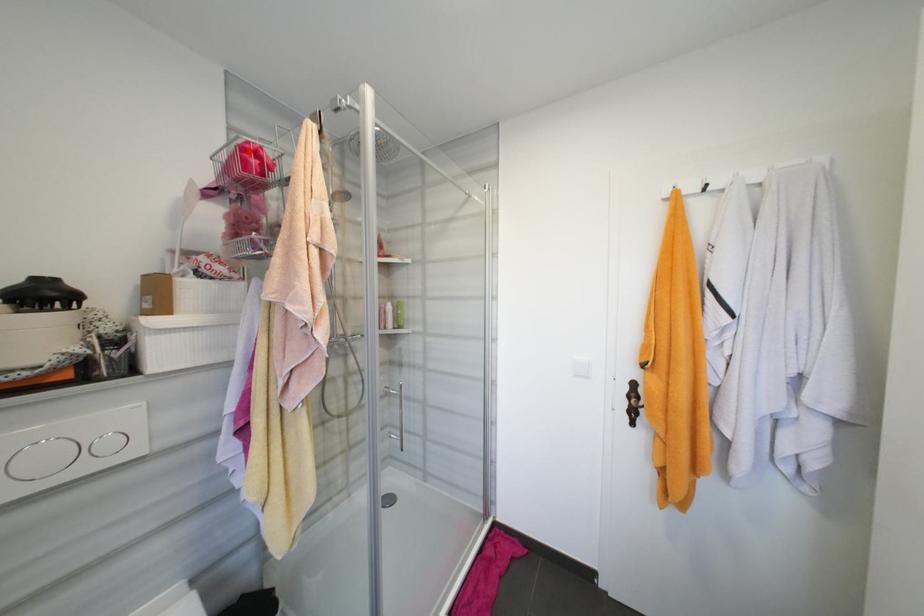
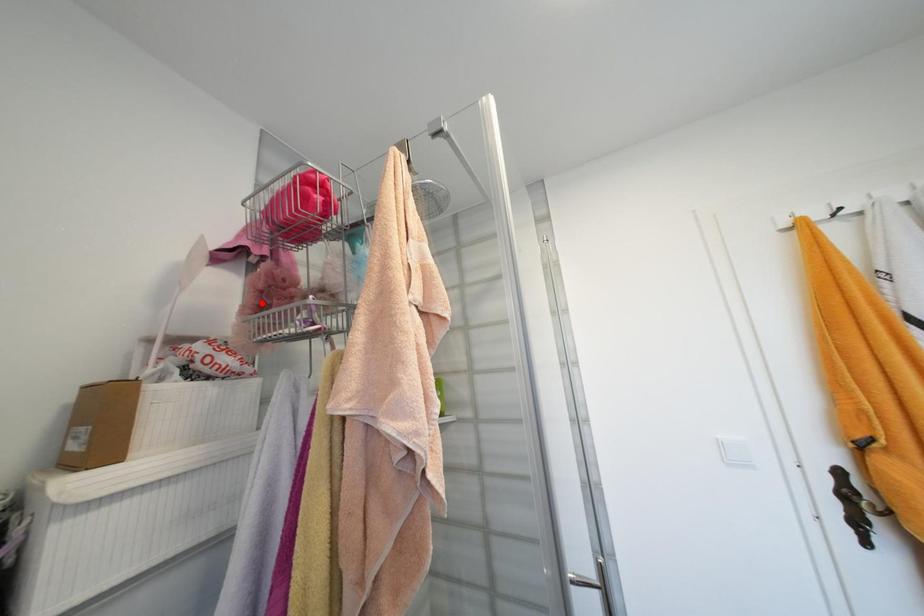
I am providing you with two images of the same scene from different viewpoints. A red point is marked on the first image and another point is marked on the second image. Is the marked point in image1 the same physical position as the marked point in image2?

No